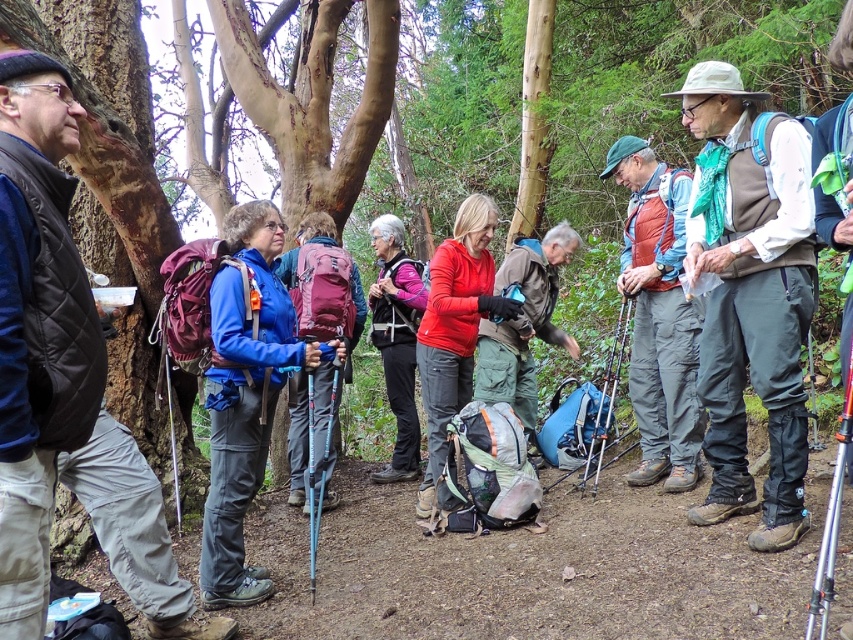
Which is more to the left, blue fabric jacket at center or matte red jacket at center?

From the viewer's perspective, blue fabric jacket at center appears more on the left side.

Image resolution: width=853 pixels, height=640 pixels. What do you see at coordinates (247, 396) in the screenshot?
I see `blue fabric jacket at center` at bounding box center [247, 396].

Which is behind, point (229, 346) or point (439, 256)?

The point (439, 256) is more distant.

Image resolution: width=853 pixels, height=640 pixels. What are the coordinates of `blue fabric jacket at center` in the screenshot? It's located at (247, 396).

Does matte red jacket at center appear over pink fabric vest at center?

No.

Who is higher up, matte red jacket at center or pink fabric vest at center?

Positioned higher is pink fabric vest at center.

What do you see at coordinates (454, 333) in the screenshot? This screenshot has height=640, width=853. I see `matte red jacket at center` at bounding box center [454, 333].

Find the location of a particular element. matte red jacket at center is located at coordinates (454, 333).

Does blue fabric jacket at center have a smaller size compared to matte red vest at center?

Yes.

Between point (242, 492) and point (653, 461), which one is positioned in front?

Point (242, 492) is in front.

Locate an element on the screen. The image size is (853, 640). blue fabric jacket at center is located at coordinates (247, 396).